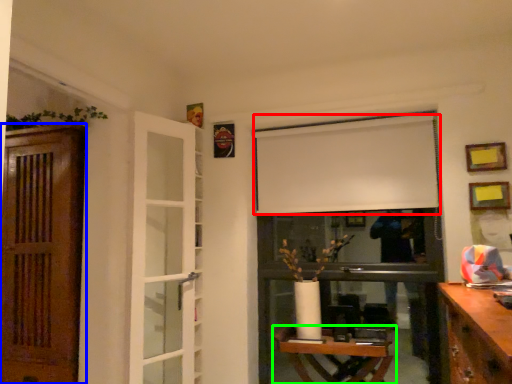
Question: Estimate the real-world distances between objects in this image. Which object is farther from curtain (highlighted by a red box), door (highlighted by a blue box) or table (highlighted by a green box)?

Choices:
 (A) door
 (B) table

Answer: (A)